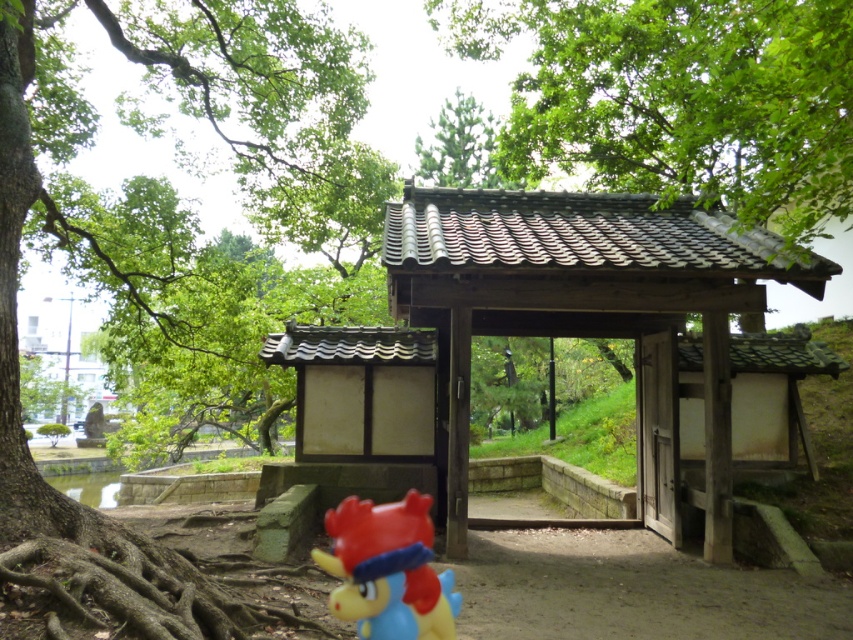
You are standing at the traditional Japanese gate and want to walk towards the point that is closer to you. Which point should you head towards, point (32, 70) or point (355, 550)?

You should head towards point (32, 70) because it is closer to you than point (355, 550).

You are a visitor at the shrine and want to take a photo of the traditional Japanese gate. You notice two green trees in the background. How far apart are the green leafy tree at upper center and the green matte tree at upper center?

The distance between the green leafy tree at upper center and the green matte tree at upper center is 8.23 meters.

You are standing at the base of the green leafy tree at upper center and want to throw a ball to a friend who is 5 meters away from you. Can you reach your friend with one throw?

The distance between you and your friend is exactly 5 meters, so if you can throw the ball that far, you can reach them with one throw.